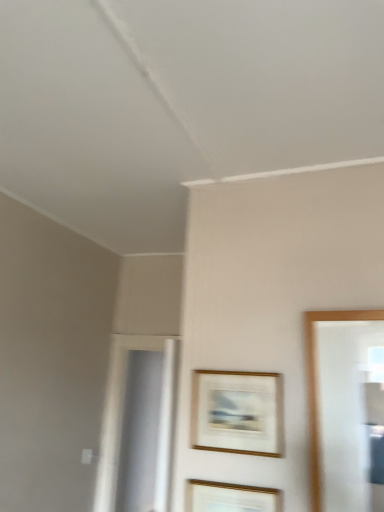
Question: Which direction should I rotate to face gold-framed picture at center, which ranks as the 1th picture frame in bottom-to-top order, — up or down?

Choices:
 (A) down
 (B) up

Answer: (A)

Question: From a real-world perspective, is gold-framed picture at center, which ranks as the 1th picture frame in bottom-to-top order, positioned over gold-framed artwork at center, which appears as the 2th picture frame when ordered from the bottom, based on gravity?

Choices:
 (A) yes
 (B) no

Answer: (B)

Question: Can you confirm if gold-framed picture at center, which ranks as the 1th picture frame in bottom-to-top order, is thinner than gold-framed artwork at center, which is the 1th picture frame from top to bottom?

Choices:
 (A) yes
 (B) no

Answer: (B)

Question: Can you confirm if gold-framed picture at center, which ranks as the 1th picture frame in bottom-to-top order, is smaller than gold-framed artwork at center, which appears as the 2th picture frame when ordered from the bottom?

Choices:
 (A) no
 (B) yes

Answer: (A)

Question: Does gold-framed picture at center, acting as the 2th picture frame starting from the top, touch gold-framed artwork at center, which appears as the 2th picture frame when ordered from the bottom?

Choices:
 (A) yes
 (B) no

Answer: (B)

Question: Is gold-framed artwork at center, which appears as the 2th picture frame when ordered from the bottom, completely or partially inside gold-framed picture at center, acting as the 2th picture frame starting from the top?

Choices:
 (A) no
 (B) yes

Answer: (A)

Question: Is gold-framed picture at center, acting as the 2th picture frame starting from the top, behind gold-framed artwork at center, which is the 1th picture frame from top to bottom?

Choices:
 (A) no
 (B) yes

Answer: (A)

Question: From a real-world perspective, is gold-framed artwork at center, which is the 1th picture frame from top to bottom, physically below gold-framed picture at center, which ranks as the 1th picture frame in bottom-to-top order?

Choices:
 (A) yes
 (B) no

Answer: (B)

Question: Is gold-framed picture at center, acting as the 2th picture frame starting from the top, a part of gold-framed artwork at center, which appears as the 2th picture frame when ordered from the bottom?

Choices:
 (A) no
 (B) yes

Answer: (A)

Question: Is gold-framed artwork at center, which appears as the 2th picture frame when ordered from the bottom, smaller than gold-framed picture at center, acting as the 2th picture frame starting from the top?

Choices:
 (A) no
 (B) yes

Answer: (B)

Question: Is gold-framed artwork at center, which is the 1th picture frame from top to bottom, next to gold-framed picture at center, which ranks as the 1th picture frame in bottom-to-top order, and touching it?

Choices:
 (A) yes
 (B) no

Answer: (B)

Question: From the image's perspective, is gold-framed artwork at center, which is the 1th picture frame from top to bottom, located beneath gold-framed picture at center, which ranks as the 1th picture frame in bottom-to-top order?

Choices:
 (A) yes
 (B) no

Answer: (B)

Question: From the image's perspective, is gold-framed artwork at center, which appears as the 2th picture frame when ordered from the bottom, located above gold-framed picture at center, which ranks as the 1th picture frame in bottom-to-top order?

Choices:
 (A) no
 (B) yes

Answer: (B)

Question: Is gold-framed picture at center, acting as the 2th picture frame starting from the top, bigger or smaller than gold-framed artwork at center, which is the 1th picture frame from top to bottom?

Choices:
 (A) small
 (B) big

Answer: (B)